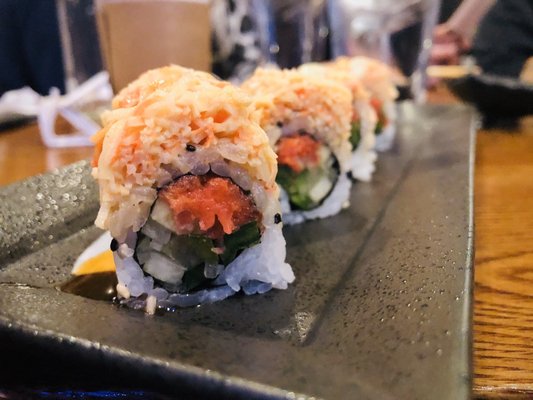
The image size is (533, 400). What are the coordinates of `retangular plate` in the screenshot? It's located at (331, 257).